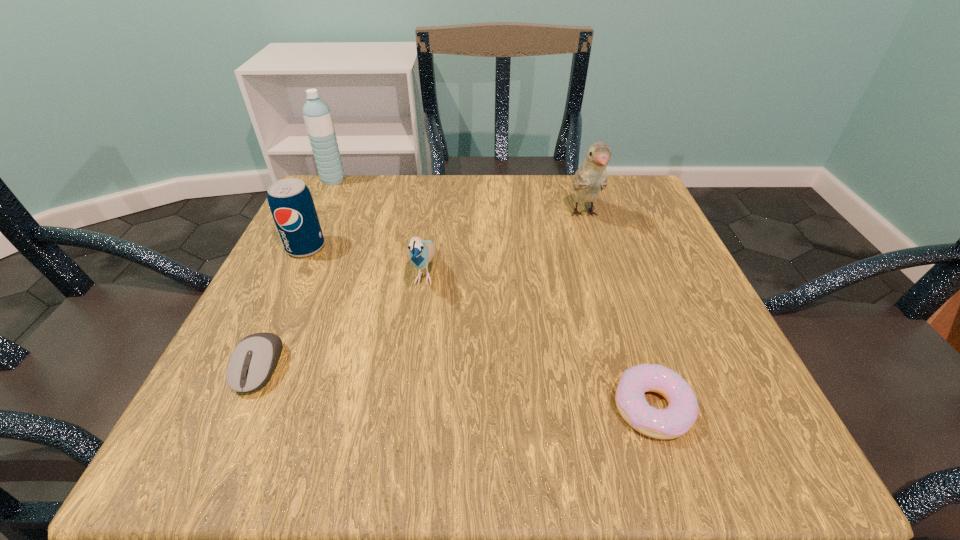
Image resolution: width=960 pixels, height=540 pixels. What are the coordinates of `the farthest object` in the screenshot? It's located at (317, 115).

What are the coordinates of `the tallest object` in the screenshot? It's located at (317, 115).

Identify the location of the right bird. (591, 177).

Where is `the taller bird`? the taller bird is located at coordinates (591, 177).

I want to click on pop, so pyautogui.click(x=291, y=204).

At what (x,y) coordinates should I click in order to perform the action: click on the shorter bird. Please return your answer as a coordinate pair (x, y). The height and width of the screenshot is (540, 960). Looking at the image, I should click on pos(420,252).

At what (x,y) coordinates should I click in order to perform the action: click on the nearer bird. Please return your answer as a coordinate pair (x, y). This screenshot has width=960, height=540. Looking at the image, I should click on (420, 252).

At what (x,y) coordinates should I click in order to perform the action: click on doughnut. Please return your answer as a coordinate pair (x, y). The height and width of the screenshot is (540, 960). Looking at the image, I should click on (675, 420).

Image resolution: width=960 pixels, height=540 pixels. I want to click on computer equipment, so point(252,363).

I want to click on vacant area situated 0.260m on the front of the tallest object, so click(x=297, y=255).